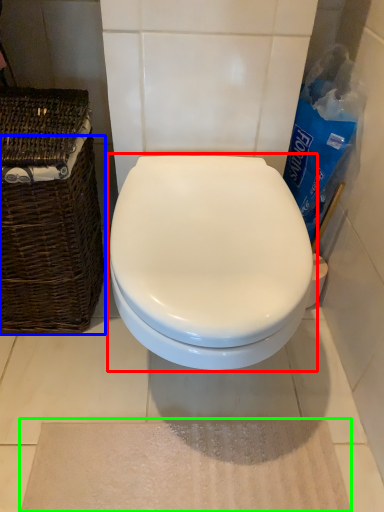
Question: Considering the real-world distances, which object is closest to toilet (highlighted by a red box)? basket (highlighted by a blue box) or bath mat (highlighted by a green box).

Choices:
 (A) basket
 (B) bath mat

Answer: (A)